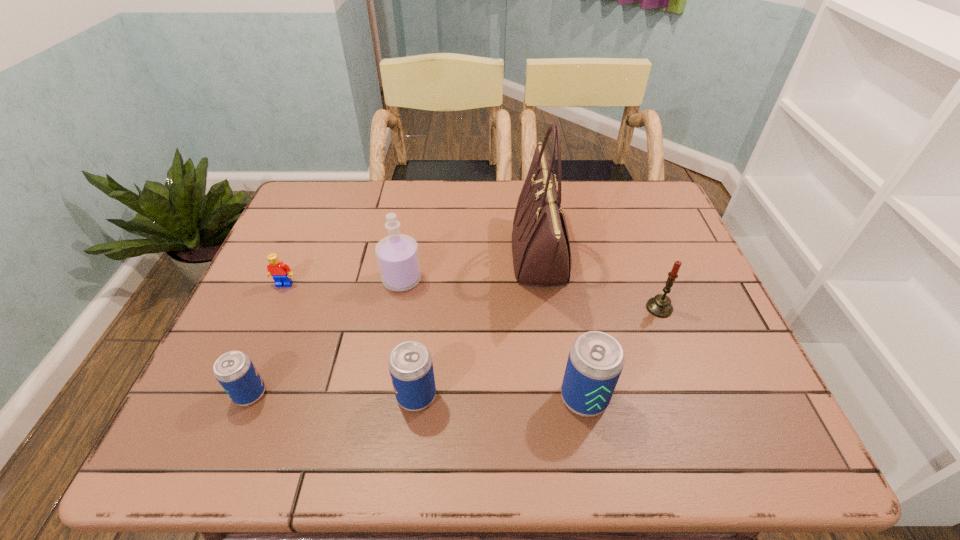
The image size is (960, 540). In order to click on the leftmost beer can in this screenshot , I will do `click(234, 370)`.

Where is `the second tallest beer can`? the second tallest beer can is located at coordinates (410, 364).

At what (x,y) coordinates should I click in order to perform the action: click on the tallest beer can. Please return your answer as a coordinate pair (x, y). Looking at the image, I should click on (595, 362).

At what (x,y) coordinates should I click in order to perform the action: click on handbag. Please return your answer as a coordinate pair (x, y). Image resolution: width=960 pixels, height=540 pixels. Looking at the image, I should click on (541, 252).

This screenshot has height=540, width=960. Identify the location of the rightmost object. (660, 306).

At what (x,y) coordinates should I click in order to perform the action: click on the sixth shortest object. Please return your answer as a coordinate pair (x, y). This screenshot has height=540, width=960. Looking at the image, I should click on point(397,254).

Identify the location of Lego. This screenshot has height=540, width=960. (281, 273).

Where is `free space located on the right of the leftmost beer can`? free space located on the right of the leftmost beer can is located at coordinates (413, 394).

I want to click on vacant space located on the right of the second beer can from left to right, so click(x=568, y=396).

Find the location of `free region located on the left of the tallest beer can`. free region located on the left of the tallest beer can is located at coordinates (363, 398).